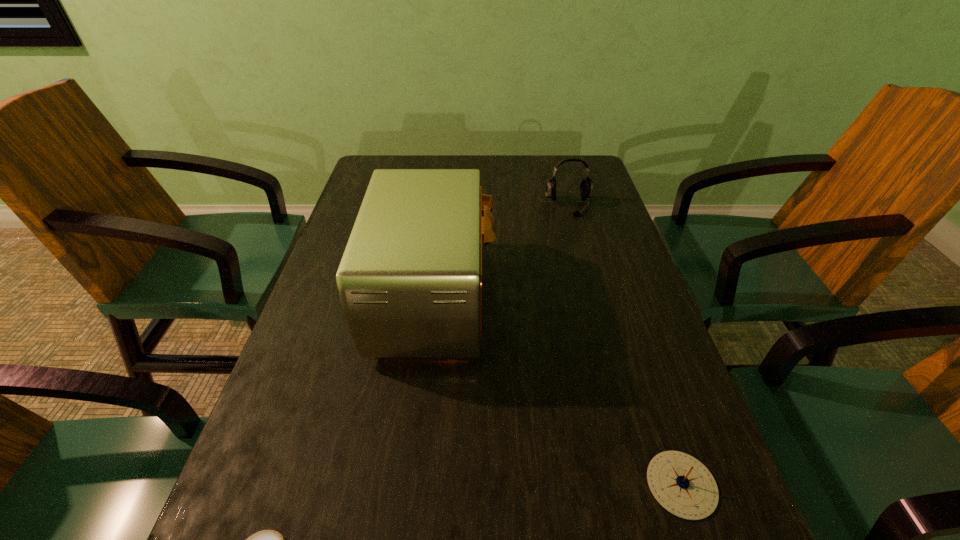
Where is `toaster oven`? This screenshot has width=960, height=540. toaster oven is located at coordinates (410, 280).

This screenshot has height=540, width=960. Find the location of `the tallest object`. the tallest object is located at coordinates (410, 280).

At what (x,y) coordinates should I click in order to perform the action: click on the farthest object. Please return your answer as a coordinate pair (x, y). Looking at the image, I should click on (x=586, y=187).

Find the location of a particular element. The image size is (960, 540). headset is located at coordinates (586, 187).

Where is `the second shortest object`? This screenshot has height=540, width=960. the second shortest object is located at coordinates (679, 482).

This screenshot has height=540, width=960. What are the coordinates of `the second nearest object` in the screenshot? It's located at (679, 482).

In order to click on vacant region located on the door side of the toaster oven in this screenshot , I will do point(520,297).

I want to click on free point located 0.070m with the microphone on the side of the headset, so click(x=576, y=232).

Image resolution: width=960 pixels, height=540 pixels. Identify the location of free space located 0.130m on the back of the third farthest object. (648, 385).

Find the location of `object that is positioned at the left edge`. object that is positioned at the left edge is located at coordinates (410, 280).